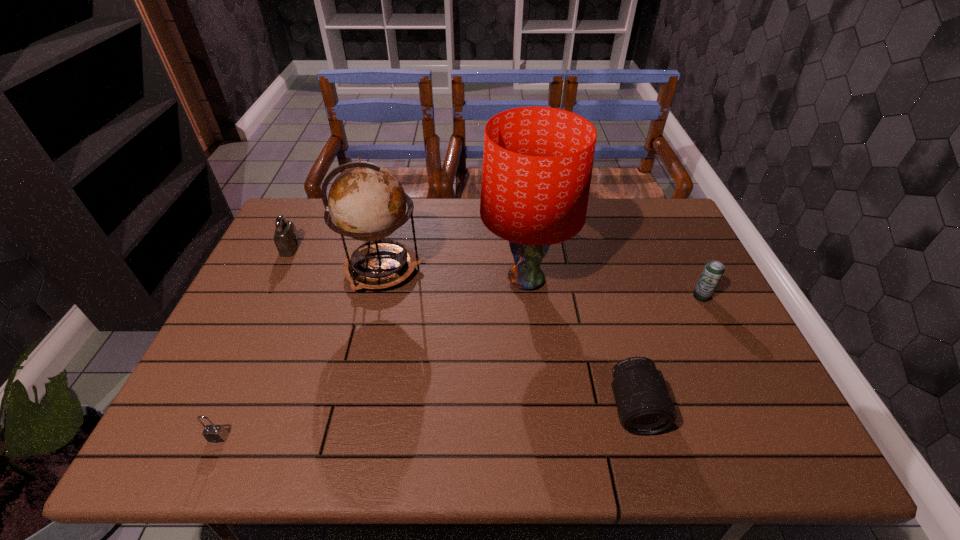
Where is `the tallest object`? Image resolution: width=960 pixels, height=540 pixels. the tallest object is located at coordinates (537, 161).

Locate an element on the screen. This screenshot has height=540, width=960. lampshade is located at coordinates (537, 161).

Where is `the third object from left to right`? The height and width of the screenshot is (540, 960). the third object from left to right is located at coordinates (366, 202).

This screenshot has height=540, width=960. I want to click on the second tallest object, so click(x=366, y=202).

The image size is (960, 540). What are the coordinates of `the farther padlock` in the screenshot? It's located at (286, 238).

Locate an element on the screen. The height and width of the screenshot is (540, 960). beer can is located at coordinates (713, 271).

The height and width of the screenshot is (540, 960). Find the location of `the second object from right to left`. the second object from right to left is located at coordinates (644, 406).

At what (x,y) coordinates should I click in order to perform the action: click on the shorter padlock. Please return your answer as a coordinate pair (x, y). Looking at the image, I should click on (212, 433).

You are a GUI agent. You are given a task and a screenshot of the screen. Output one action in this format:
    pyautogui.click(x=<x>, y=<y>)
    Task: Click on the nearer padlock
    
    Given the screenshot: What is the action you would take?
    pyautogui.click(x=212, y=433)

Locate an element on the screen. Image resolution: width=960 pixels, height=540 pixels. vacant space located on the front-facing side of the tallest object is located at coordinates (540, 409).